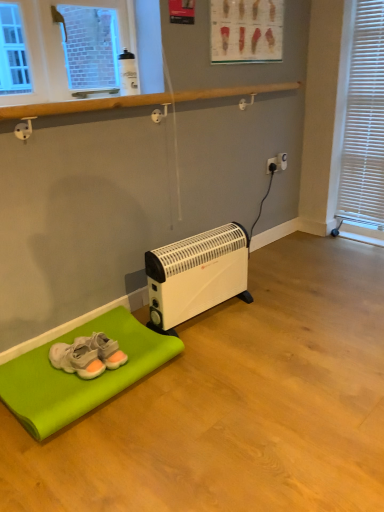
You are a GUI agent. You are given a task and a screenshot of the screen. Output one action in this format:
    pyautogui.click(x=<x>, y=<y>)
    Task: Click on the vacant area that is situated to the right of green fabric mat at lower left
    
    Given the screenshot: What is the action you would take?
    pyautogui.click(x=223, y=396)